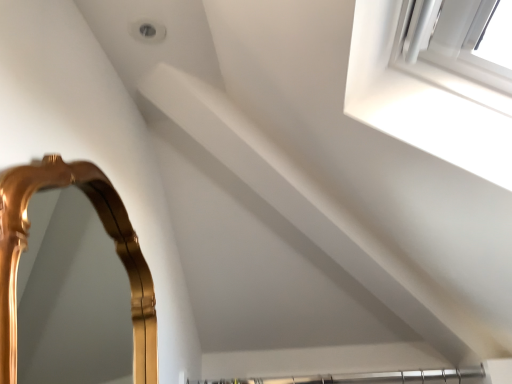
What do you see at coordinates (424, 98) in the screenshot? The width and height of the screenshot is (512, 384). I see `white plastic window at upper right` at bounding box center [424, 98].

Find the location of a particular element. white plastic window at upper right is located at coordinates (424, 98).

From the picture: Measure the distance between point (412,98) and camera.

Point (412,98) and camera are 36.93 inches apart from each other.

Locate an element on the screen. white plastic window at upper right is located at coordinates click(x=424, y=98).